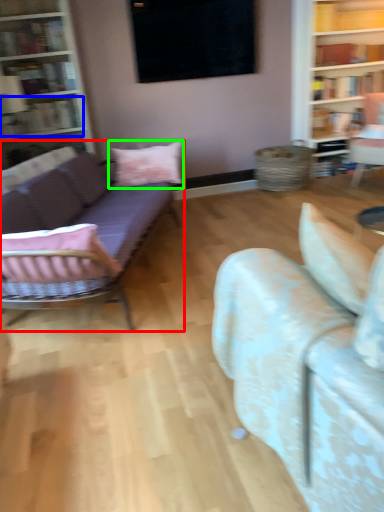
Question: Considering the real-world distances, which object is farthest from studio couch (highlighted by a red box)? book (highlighted by a blue box) or pillow (highlighted by a green box)?

Choices:
 (A) book
 (B) pillow

Answer: (A)